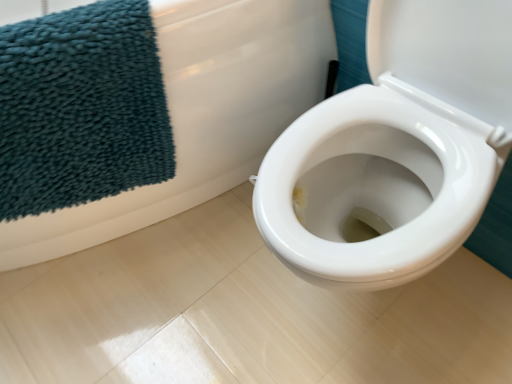
Question: From the image's perspective, is white glossy toilet at center right located above or below teal plush towel at upper left?

Choices:
 (A) above
 (B) below

Answer: (A)

Question: Choose the correct answer: Is white glossy toilet at center right inside teal plush towel at upper left or outside it?

Choices:
 (A) outside
 (B) inside

Answer: (A)

Question: From their relative heights in the image, would you say white glossy toilet at center right is taller or shorter than teal plush towel at upper left?

Choices:
 (A) short
 (B) tall

Answer: (B)

Question: From the image's perspective, is teal plush towel at upper left located above or below white glossy toilet at center right?

Choices:
 (A) below
 (B) above

Answer: (A)

Question: Is teal plush towel at upper left spatially inside white glossy toilet at center right, or outside of it?

Choices:
 (A) inside
 (B) outside

Answer: (A)

Question: Visually, is teal plush towel at upper left positioned to the left or to the right of white glossy toilet at center right?

Choices:
 (A) right
 (B) left

Answer: (A)

Question: Based on their sizes in the image, would you say teal plush towel at upper left is bigger or smaller than white glossy toilet at center right?

Choices:
 (A) small
 (B) big

Answer: (A)